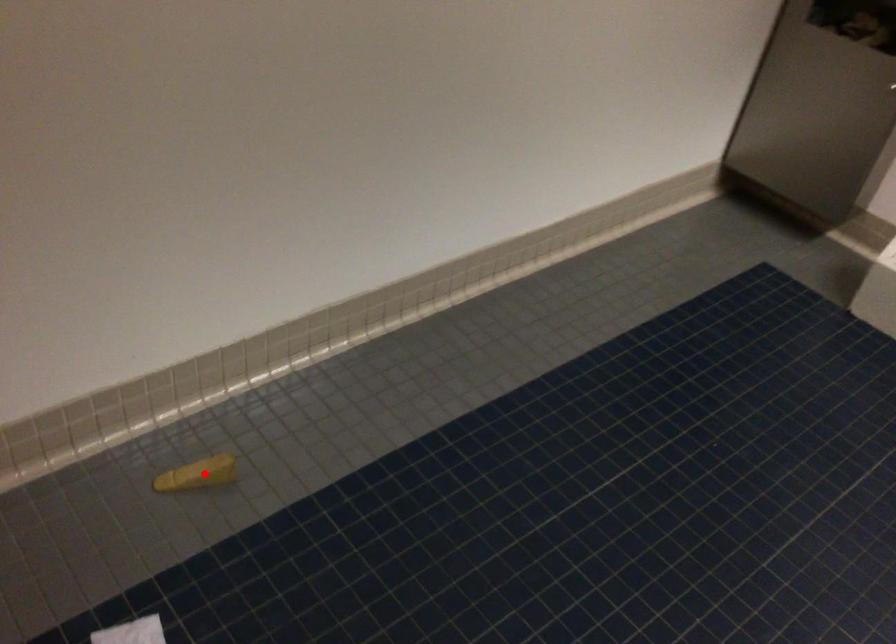
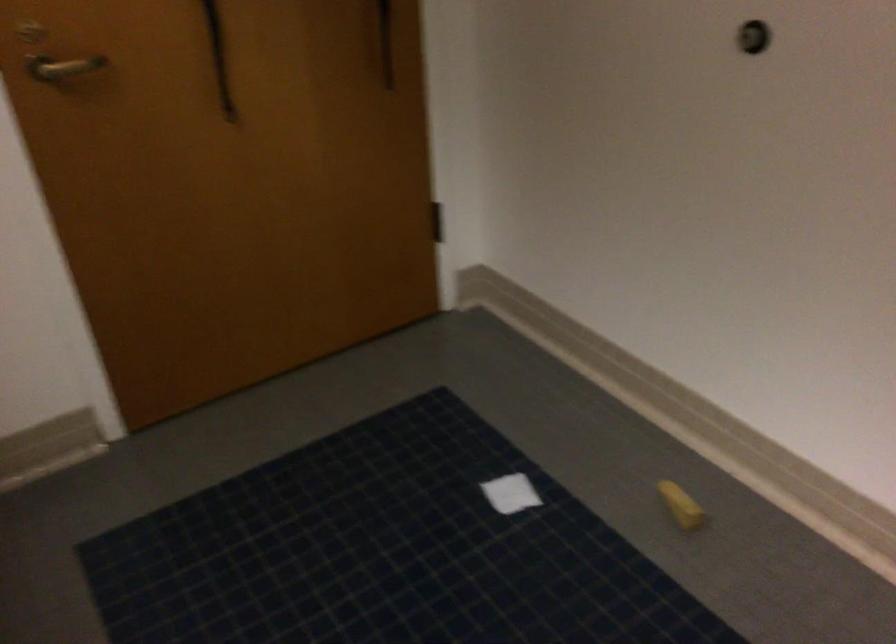
The point at the highlighted location is marked in the first image. Where is the corresponding point in the second image?

(681, 505)